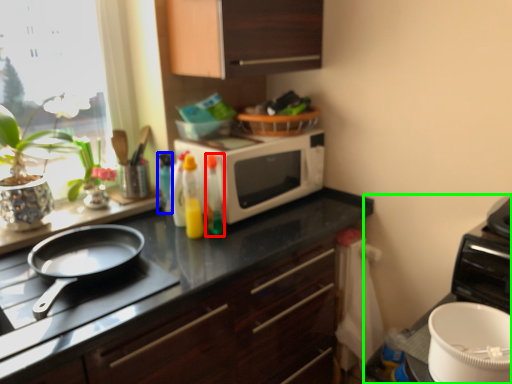
Question: Estimate the real-world distances between objects in this image. Which object is closer to bottle (highlighted by a red box), bottle (highlighted by a blue box) or appliance (highlighted by a green box)?

Choices:
 (A) bottle
 (B) appliance

Answer: (A)